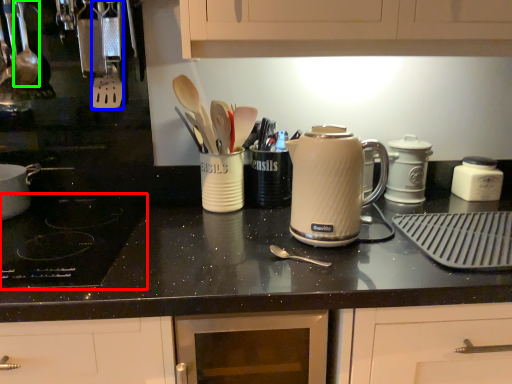
Question: Estimate the real-world distances between objects in this image. Which object is closer to gas stove (highlighted by a red box), silverware (highlighted by a blue box) or utensil (highlighted by a green box)?

Choices:
 (A) silverware
 (B) utensil

Answer: (A)